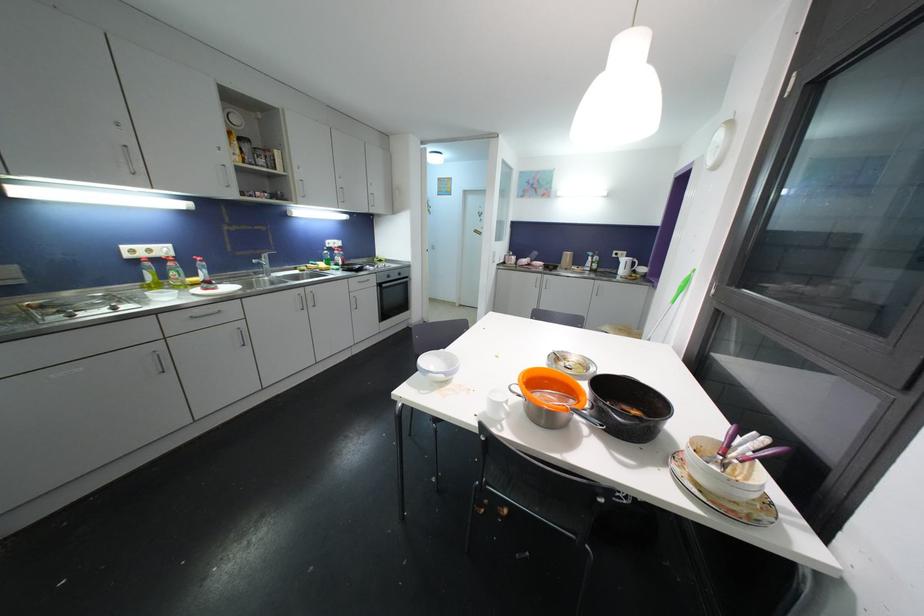
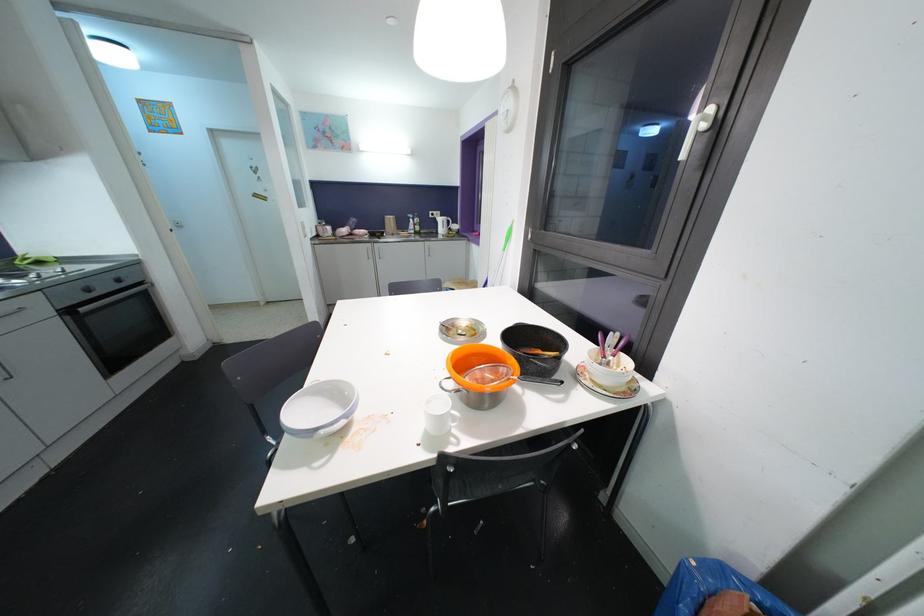
Locate, in the second image, the point that corresponds to pixel 508 406 in the first image.

(456, 411)